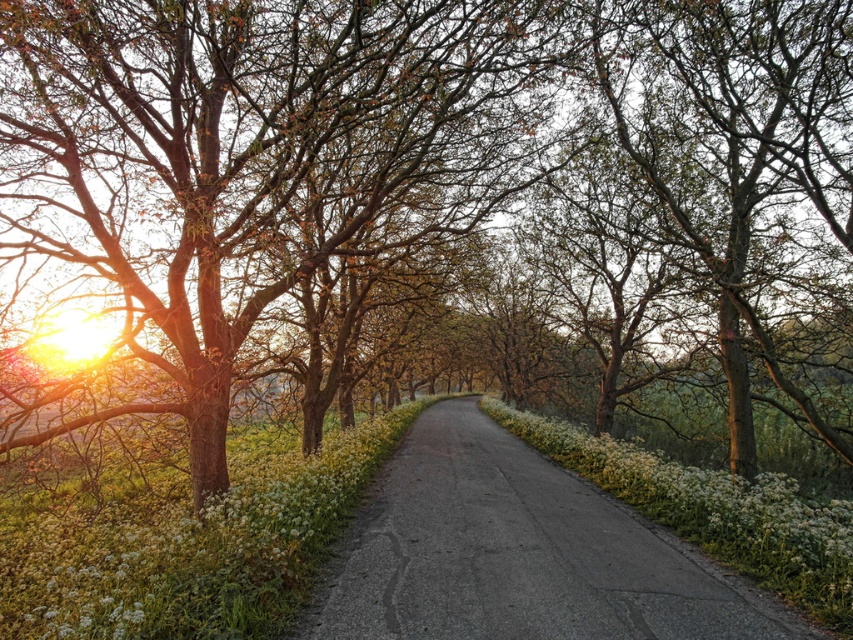
You are standing at the starting point of the road and want to reach the end of the asphalt road at center. According to the coordinates provided, in which direction should you walk to stay on the road?

The asphalt road at center is located at coordinates approximately 0.866 along the x and 0.610 along the y. Since the road curves gently, you should follow the direction indicated by these coordinates to stay on the path towards the end of the road.

You are standing at the starting point of the road in the rural scene. You see two points marked on the road ahead of you. The first point is at coordinates point (x=770, y=628) and the second is at point (x=56, y=550). Which point is closer to your current position?

Point (x=770, y=628) is closer to the camera than point (x=56, y=550), so the first point is closer to your current position.